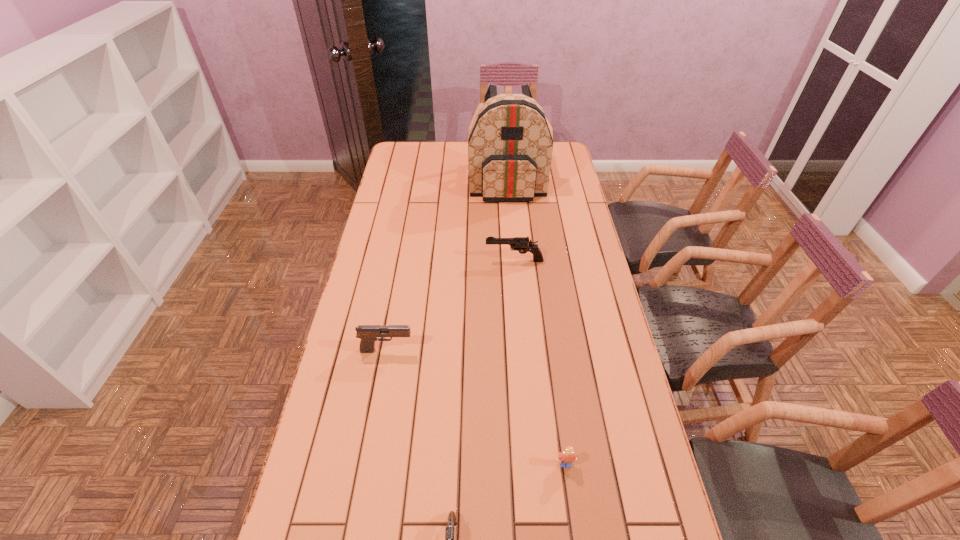
Find the location of a particular element. Image resolution: width=960 pixels, height=540 pixels. the farthest object is located at coordinates (510, 146).

Identify the location of the tallest object. (510, 146).

At what (x,y) coordinates should I click in order to perform the action: click on the third nearest object. Please return your answer as a coordinate pair (x, y). The height and width of the screenshot is (540, 960). Looking at the image, I should click on (367, 333).

At what (x,y) coordinates should I click in order to perform the action: click on pistol. Please return your answer as a coordinate pair (x, y). Looking at the image, I should click on (367, 333).

This screenshot has width=960, height=540. I want to click on the taller gun, so click(522, 244).

Image resolution: width=960 pixels, height=540 pixels. Find the location of `the right gun`. the right gun is located at coordinates (522, 244).

Find the location of `the fourth farthest object`. the fourth farthest object is located at coordinates (566, 458).

In order to click on Lego in this screenshot , I will do `click(566, 458)`.

Where is `vacant area located on the front face of the tallest object`? vacant area located on the front face of the tallest object is located at coordinates (511, 230).

The width and height of the screenshot is (960, 540). Identify the location of free spot located 0.200m aim along the barrel of the third nearest object. (480, 350).